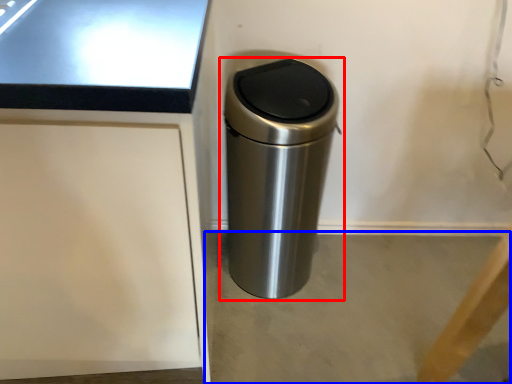
Question: Which of the following is the closest to the observer, waste container (highlighted by a red box) or concrete (highlighted by a blue box)?

Choices:
 (A) waste container
 (B) concrete

Answer: (A)